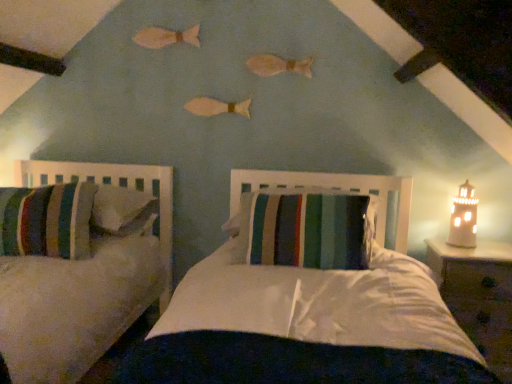
Identify the location of empty space that is to the right of white ceramic lighthouse at right. (493, 249).